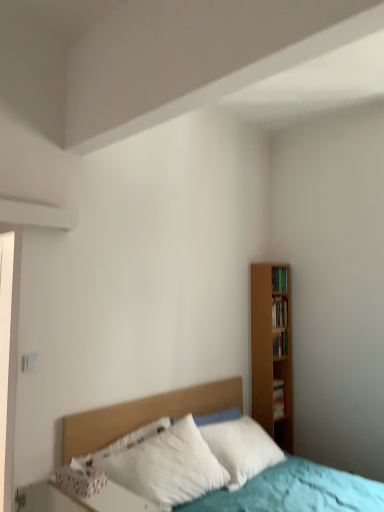
Question: Is wooden bookshelf at right, placed as the second book when sorted from bottom to top, smaller than wooden headboard at center?

Choices:
 (A) no
 (B) yes

Answer: (B)

Question: Can we say wooden bookshelf at right, which is counted as the 3th book, starting from the top, lies outside wooden headboard at center?

Choices:
 (A) no
 (B) yes

Answer: (B)

Question: Does wooden bookshelf at right, which is counted as the 3th book, starting from the top, touch wooden headboard at center?

Choices:
 (A) yes
 (B) no

Answer: (B)

Question: Is the position of wooden bookshelf at right, placed as the second book when sorted from bottom to top, more distant than that of wooden headboard at center?

Choices:
 (A) yes
 (B) no

Answer: (A)

Question: Is wooden headboard at center at the back of wooden bookshelf at right, placed as the second book when sorted from bottom to top?

Choices:
 (A) yes
 (B) no

Answer: (B)

Question: From the image's perspective, does wooden bookshelf at right, placed as the second book when sorted from bottom to top, appear higher than wooden headboard at center?

Choices:
 (A) yes
 (B) no

Answer: (A)

Question: Can you confirm if wooden bookshelf at right, the 1th book when ordered from top to bottom, is positioned to the left of wooden bookshelf at right, marked as the 3th book in a bottom-to-top arrangement?

Choices:
 (A) yes
 (B) no

Answer: (B)

Question: Is wooden bookshelf at right, the 1th book when ordered from top to bottom, aimed at wooden bookshelf at right, marked as the second book in a top-to-bottom arrangement?

Choices:
 (A) yes
 (B) no

Answer: (B)

Question: Does wooden bookshelf at right, which is the 4th book in bottom-to-top order, have a larger size compared to wooden bookshelf at right, marked as the second book in a top-to-bottom arrangement?

Choices:
 (A) no
 (B) yes

Answer: (A)

Question: Considering the relative sizes of wooden bookshelf at right, which is the 4th book in bottom-to-top order, and wooden bookshelf at right, marked as the second book in a top-to-bottom arrangement, in the image provided, is wooden bookshelf at right, which is the 4th book in bottom-to-top order, smaller than wooden bookshelf at right, marked as the second book in a top-to-bottom arrangement,?

Choices:
 (A) yes
 (B) no

Answer: (A)

Question: Is wooden bookshelf at right, the 1th book when ordered from top to bottom, taller than wooden bookshelf at right, marked as the 3th book in a bottom-to-top arrangement?

Choices:
 (A) yes
 (B) no

Answer: (B)

Question: From the image's perspective, is wooden bookshelf at right, the 1th book when ordered from top to bottom, on wooden bookshelf at right, marked as the second book in a top-to-bottom arrangement?

Choices:
 (A) no
 (B) yes

Answer: (B)

Question: Can you confirm if wooden bookshelf at right, which is the 4th book in bottom-to-top order, is wider than hardcover book at right, the 4th book from the top?

Choices:
 (A) no
 (B) yes

Answer: (A)